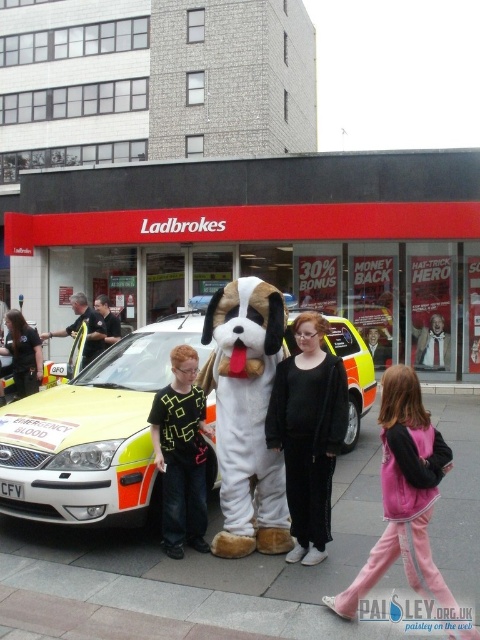
Question: Which of these objects is positioned farthest from the velvet pink tracksuit at lower right?

Choices:
 (A) black shirt at center
 (B) neon green fabric shirt at center

Answer: (A)

Question: Which point is farther to the camera?

Choices:
 (A) furry white and brown dog at center
 (B) white plush dog at center
 (C) black shirt at center

Answer: (B)

Question: Is furry white and brown dog at center above dark blue uniform at left?

Choices:
 (A) no
 (B) yes

Answer: (A)

Question: Can you confirm if velvet pink tracksuit at lower right is positioned to the right of neon green fabric shirt at center?

Choices:
 (A) no
 (B) yes

Answer: (B)

Question: Does dark blue uniform at left have a smaller size compared to white plush dog at center?

Choices:
 (A) no
 (B) yes

Answer: (A)

Question: Among these objects, which one is nearest to the camera?

Choices:
 (A) velvet pink tracksuit at lower right
 (B) neon green fabric shirt at center

Answer: (A)